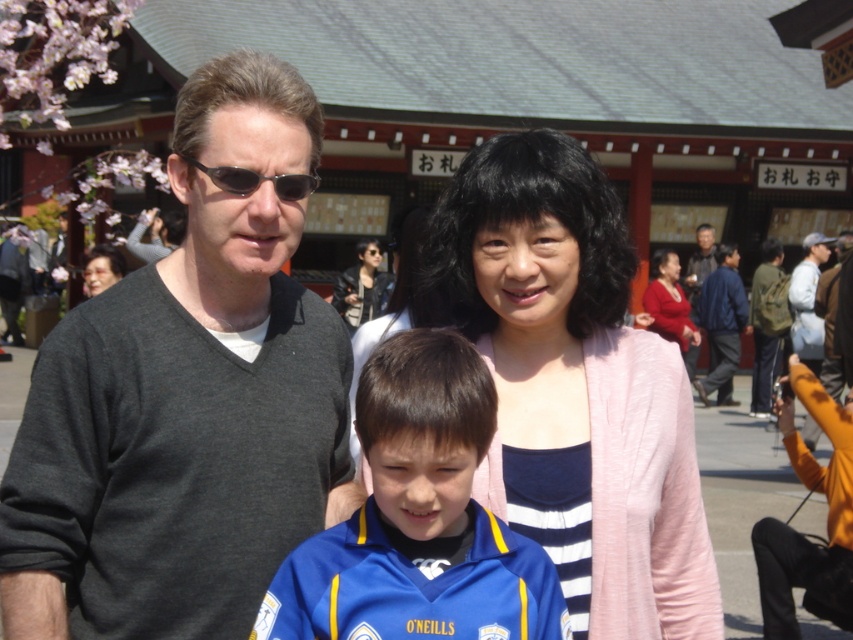
You are standing at the center of the image and want to place a small object exactly between the light gray jacket at right and another object. Which object is the other object you should consider for this placement?

The light gray jacket at right is located at point (x=809, y=304). Since there is no other object specified in the Objects list besides the light gray jacket, you cannot determine the other object to place the small object between.

In the image, there are two adults and a child. The adults are wearing a dark gray sweater at left and a blue jersey at center. From the perspective of someone standing in front of them, which adult is positioned to the right of the other?

The blue jersey at center is to the right of the dark gray sweater at left.